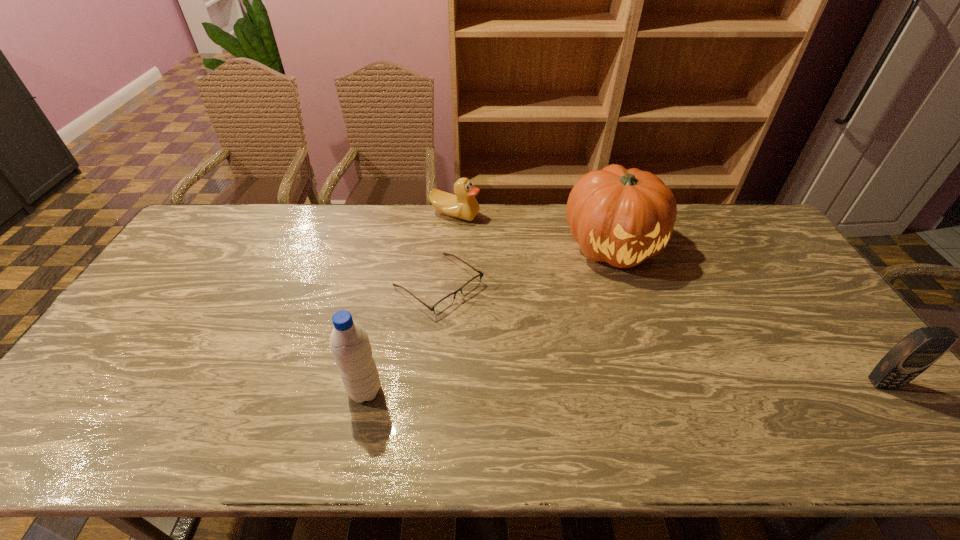
Identify the location of free spot between the spectacles and the pumpkin. (525, 266).

This screenshot has width=960, height=540. Find the location of `unoccupied position between the spectacles and the rightmost object`. unoccupied position between the spectacles and the rightmost object is located at coordinates (660, 334).

I want to click on vacant point located between the third tallest object and the second object from right to left, so click(748, 315).

The image size is (960, 540). Find the location of `empty space that is in between the cellular telephone and the spectacles`. empty space that is in between the cellular telephone and the spectacles is located at coordinates (660, 334).

Find the location of a particular element. empty location between the fourth object from left to right and the water bottle is located at coordinates (489, 319).

Where is `empty location between the shortest object and the second object from right to left`? empty location between the shortest object and the second object from right to left is located at coordinates (525, 266).

This screenshot has width=960, height=540. I want to click on vacant point located between the rightmost object and the water bottle, so click(x=624, y=387).

Locate an element on the screen. vacant space that is in between the fourth object from left to right and the duck is located at coordinates (534, 231).

Select which object appears as the closest to the fourth tallest object. Please provide its 2D coordinates. Your answer should be formatted as a tuple, i.e. [(x, y)], where the tuple contains the x and y coordinates of a point satisfying the conditions above.

[(447, 301)]

Locate which object is the fourth closest to the water bottle. Please provide its 2D coordinates. Your answer should be formatted as a tuple, i.e. [(x, y)], where the tuple contains the x and y coordinates of a point satisfying the conditions above.

[(915, 353)]